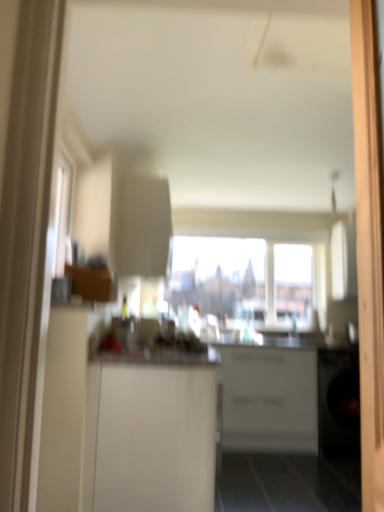
Question: In terms of height, does transparent glass window at center look taller or shorter compared to white matte cabinet at center, which is the 1th cabinetry in back-to-front order?

Choices:
 (A) short
 (B) tall

Answer: (A)

Question: From a real-world perspective, is transparent glass window at center physically located above or below white matte cabinet at center, which is the 1th cabinetry in back-to-front order?

Choices:
 (A) below
 (B) above

Answer: (B)

Question: Based on their relative distances, which object is farther from the wooden screen door at right?

Choices:
 (A) white glossy counter at center
 (B) white matte cabinet at center, marked as the 1th cabinetry in a front-to-back arrangement
 (C) transparent glass window at center
 (D) white matte cabinet at center, which is the 1th cabinetry in back-to-front order

Answer: (C)

Question: Estimate the real-world distances between objects in this image. Which object is farther from the wooden screen door at right?

Choices:
 (A) white matte cabinet at center, placed as the 2th cabinetry when sorted from back to front
 (B) white glossy counter at center
 (C) white matte cabinet at center, which is the 1th cabinetry in back-to-front order
 (D) transparent glass window at center

Answer: (D)